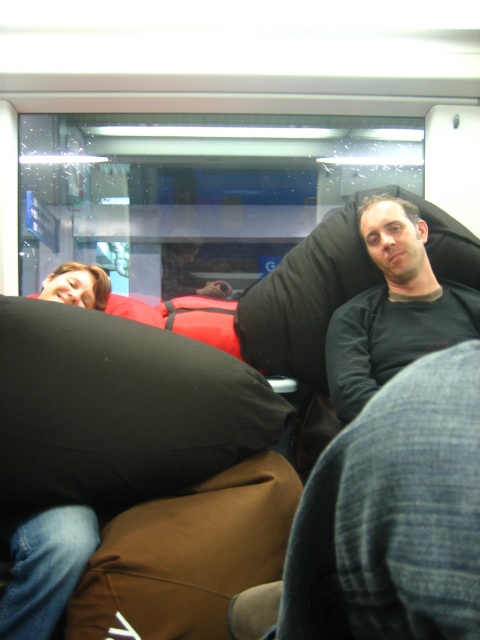
Question: Which point is farther from the camera taking this photo?

Choices:
 (A) (367, 216)
 (B) (133, 406)

Answer: (A)

Question: Does black fabric pillow at left have a larger size compared to brown fabric bean bag chair at center?

Choices:
 (A) yes
 (B) no

Answer: (A)

Question: In this image, where is black fabric pillow at left located relative to brown fabric bean bag chair at center?

Choices:
 (A) below
 (B) above

Answer: (B)

Question: Which object is the closest to the black matte shirt at upper right?

Choices:
 (A) brown fabric bean bag chair at center
 (B) black fabric pillow at left

Answer: (B)

Question: Estimate the real-world distances between objects in this image. Which object is closer to the black matte shirt at upper right?

Choices:
 (A) brown fabric bean bag chair at center
 (B) black fabric pillow at left

Answer: (B)

Question: Is black fabric pillow at left to the left of brown fabric bean bag chair at center from the viewer's perspective?

Choices:
 (A) no
 (B) yes

Answer: (B)